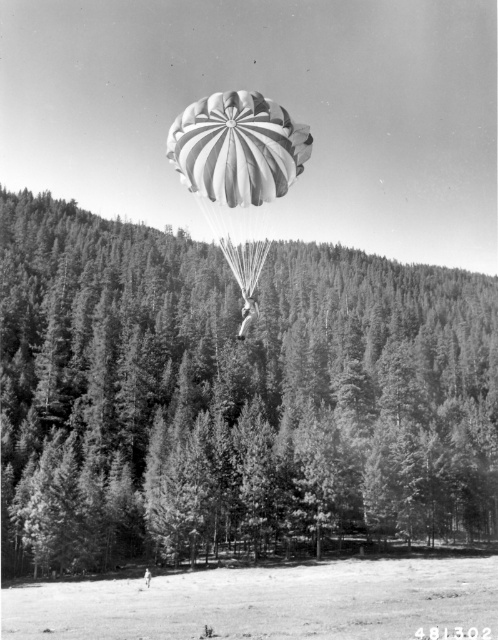
Is green leafy tree at center taller than white striped parachute at center?

In fact, green leafy tree at center may be shorter than white striped parachute at center.

Which is more to the right, green leafy tree at center or white striped parachute at center?

Positioned to the right is white striped parachute at center.

At what (x,y) coordinates should I click in order to perform the action: click on green leafy tree at center. Please return your answer as a coordinate pair (x, y). Looking at the image, I should click on (233, 397).

Is white striped parachute at center thinner than white cotton shirt at center?

Incorrect, white striped parachute at center's width is not less than white cotton shirt at center's.

At what (x,y) coordinates should I click in order to perform the action: click on white striped parachute at center. Please return your answer as a coordinate pair (x, y). Image resolution: width=498 pixels, height=640 pixels. Looking at the image, I should click on (239, 173).

Who is taller, green leafy tree at center or white cotton shirt at center?

Standing taller between the two is green leafy tree at center.

From the picture: Which is below, green leafy tree at center or white cotton shirt at center?

white cotton shirt at center is lower down.

I want to click on green leafy tree at center, so point(233,397).